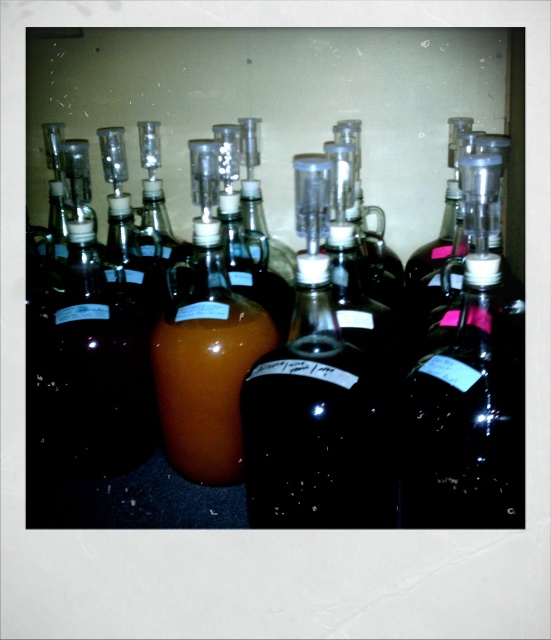
Can you confirm if translucent glass bottle at center is positioned to the right of translucent amber liquid at center?

Indeed, translucent glass bottle at center is positioned on the right side of translucent amber liquid at center.

Which is in front, point (437, 326) or point (251, 323)?

Positioned in front is point (251, 323).

Where is `translucent glass bottle at center`? This screenshot has width=551, height=640. translucent glass bottle at center is located at coordinates (102, 461).